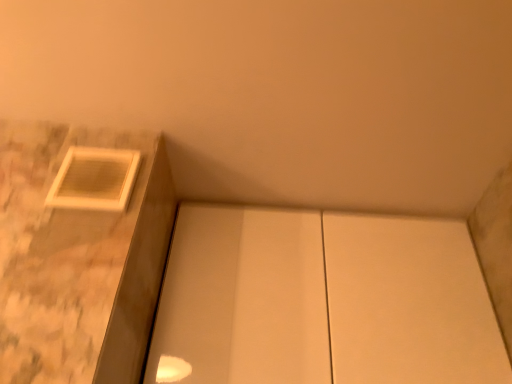
Question: Based on their sizes in the image, would you say white matte cabinet at center is bigger or smaller than matte white frame at upper left?

Choices:
 (A) small
 (B) big

Answer: (B)

Question: Choose the correct answer: Is white matte cabinet at center inside matte white frame at upper left or outside it?

Choices:
 (A) outside
 (B) inside

Answer: (A)

Question: Does point (430, 316) appear closer or farther from the camera than point (111, 177)?

Choices:
 (A) farther
 (B) closer

Answer: (A)

Question: Is matte white frame at upper left wider or thinner than white matte cabinet at center?

Choices:
 (A) wide
 (B) thin

Answer: (B)

Question: From the image's perspective, is matte white frame at upper left above or below white matte cabinet at center?

Choices:
 (A) below
 (B) above

Answer: (B)

Question: Is matte white frame at upper left bigger or smaller than white matte cabinet at center?

Choices:
 (A) small
 (B) big

Answer: (A)

Question: In terms of height, does matte white frame at upper left look taller or shorter compared to white matte cabinet at center?

Choices:
 (A) short
 (B) tall

Answer: (A)